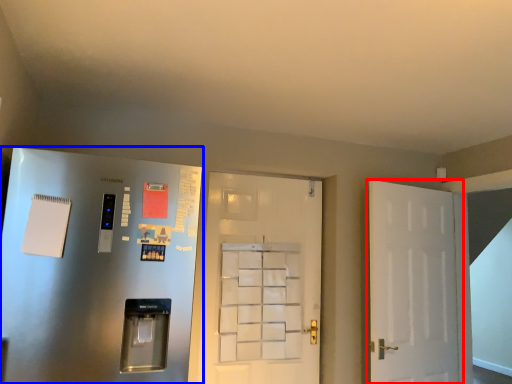
Question: Which object appears farthest to the camera in this image, door (highlighted by a red box) or door (highlighted by a blue box)?

Choices:
 (A) door
 (B) door

Answer: (A)